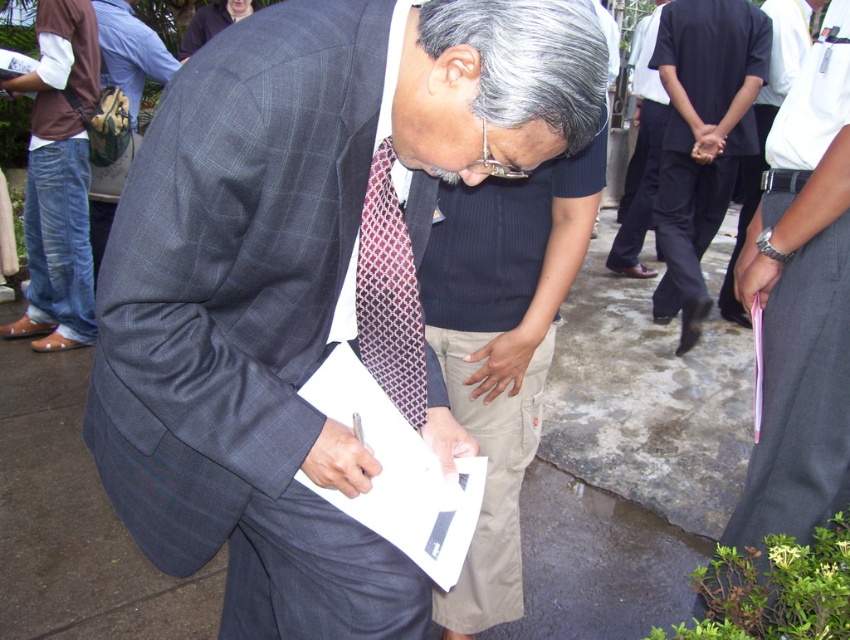
The image size is (850, 640). In order to click on dark gray suit at center in this screenshot , I will do `click(802, 304)`.

Who is higher up, dark gray suit at center or brushed metal jacket at left?

Positioned higher is brushed metal jacket at left.

Is point (847, 371) positioned before point (48, 188)?

That is True.

Find the location of a particular element. The image size is (850, 640). dark gray suit at center is located at coordinates (802, 304).

Does dark gray suit at center appear on the left side of dark blue shirt at center?

Correct, you'll find dark gray suit at center to the left of dark blue shirt at center.

Does dark gray suit at center have a larger size compared to dark blue shirt at center?

No, dark gray suit at center is not bigger than dark blue shirt at center.

At what (x,y) coordinates should I click in order to perform the action: click on dark gray suit at center. Please return your answer as a coordinate pair (x, y). Image resolution: width=850 pixels, height=640 pixels. Looking at the image, I should click on (802, 304).

Who is more forward, (x=690, y=141) or (x=61, y=108)?

Point (x=61, y=108) is in front.

Does black cotton pants at center have a greater width compared to brushed metal jacket at left?

Incorrect, black cotton pants at center's width does not surpass brushed metal jacket at left's.

Between point (703, 74) and point (94, 330), which one is positioned behind?

The point (703, 74) is more distant.

The width and height of the screenshot is (850, 640). What are the coordinates of `black cotton pants at center` in the screenshot? It's located at (701, 138).